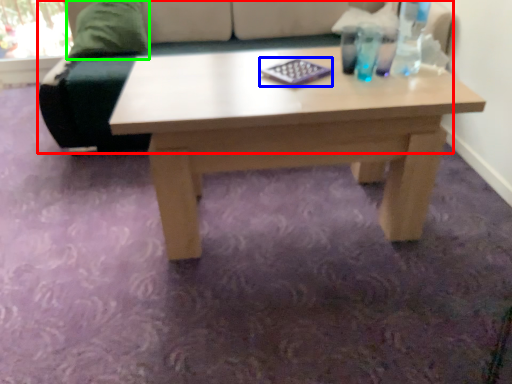
Question: Which object is the farthest from studio couch (highlighted by a red box)? Choose among these: pad (highlighted by a blue box) or pillow (highlighted by a green box).

Choices:
 (A) pad
 (B) pillow

Answer: (A)